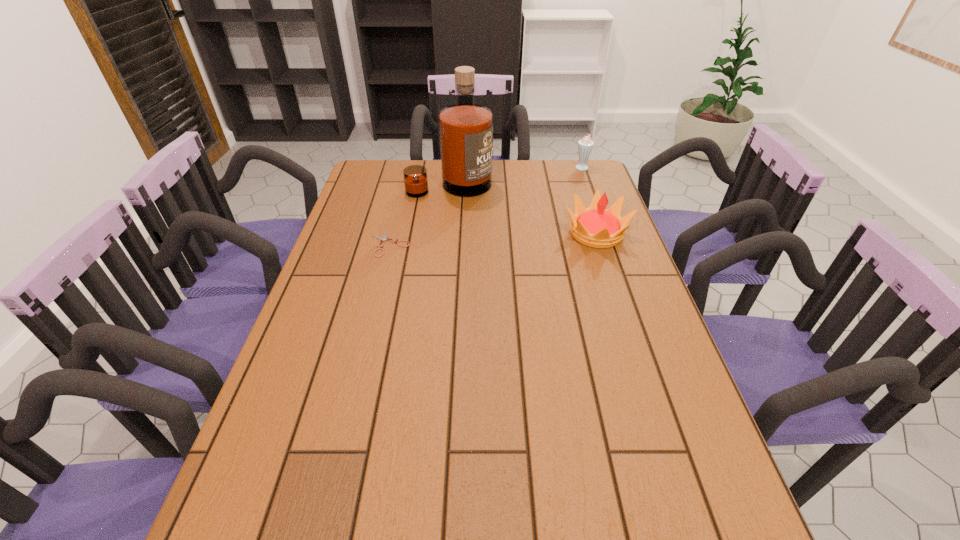
The image size is (960, 540). Find the location of `free spot on the desktop that is between the shears and the crown and is positioned on the front label of the third nearest object`. free spot on the desktop that is between the shears and the crown and is positioned on the front label of the third nearest object is located at coordinates (489, 239).

At what (x,y) coordinates should I click in order to perform the action: click on vacant space on the desktop that is between the shortest object and the crown and is positioned on the straw side of the milkshake. Please return your answer as a coordinate pair (x, y). The image size is (960, 540). Looking at the image, I should click on (514, 238).